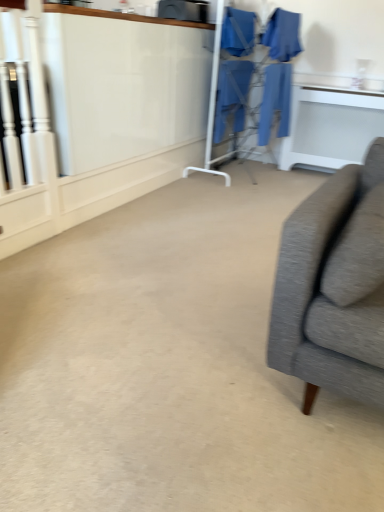
Question: In which direction should I rotate to look at blue fabric robe at upper center, the third robe in the left-to-right sequence?

Choices:
 (A) right
 (B) left

Answer: (A)

Question: Should I look upward or downward to see blue fabric robe at center, marked as the 1th robe in a left-to-right arrangement?

Choices:
 (A) down
 (B) up

Answer: (B)

Question: Can you confirm if white glossy table at upper right is taller than blue fabric laundry at center?

Choices:
 (A) no
 (B) yes

Answer: (A)

Question: From a real-world perspective, is white glossy table at upper right located higher than blue fabric laundry at center?

Choices:
 (A) no
 (B) yes

Answer: (A)

Question: Is white glossy table at upper right aimed at blue fabric laundry at center?

Choices:
 (A) no
 (B) yes

Answer: (A)

Question: Is white glossy table at upper right next to blue fabric laundry at center and touching it?

Choices:
 (A) no
 (B) yes

Answer: (A)

Question: Considering the relative sizes of white glossy table at upper right and blue fabric laundry at center in the image provided, is white glossy table at upper right smaller than blue fabric laundry at center?

Choices:
 (A) yes
 (B) no

Answer: (A)

Question: Is white glossy table at upper right outside blue fabric laundry at center?

Choices:
 (A) no
 (B) yes

Answer: (B)

Question: Does blue fabric laundry at center have a greater width compared to blue fabric robe at center, acting as the 4th robe starting from the left?

Choices:
 (A) yes
 (B) no

Answer: (A)

Question: From the image's perspective, is blue fabric laundry at center on blue fabric robe at center, which appears as the 1th robe when viewed from the right?

Choices:
 (A) yes
 (B) no

Answer: (A)

Question: Is blue fabric laundry at center positioned with its back to blue fabric robe at center, which appears as the 1th robe when viewed from the right?

Choices:
 (A) no
 (B) yes

Answer: (A)

Question: Does blue fabric laundry at center have a lesser height compared to blue fabric robe at center, acting as the 4th robe starting from the left?

Choices:
 (A) yes
 (B) no

Answer: (B)

Question: Considering the relative sizes of blue fabric laundry at center and blue fabric robe at center, acting as the 4th robe starting from the left, in the image provided, is blue fabric laundry at center taller than blue fabric robe at center, acting as the 4th robe starting from the left,?

Choices:
 (A) yes
 (B) no

Answer: (A)

Question: Is blue fabric laundry at center in front of blue fabric robe at center, which appears as the 1th robe when viewed from the right?

Choices:
 (A) yes
 (B) no

Answer: (A)

Question: From a real-world perspective, is blue fabric robe at center, which appears as the 1th robe when viewed from the right, on top of blue fabric robe at center, the 4th robe when ordered from right to left?

Choices:
 (A) yes
 (B) no

Answer: (B)